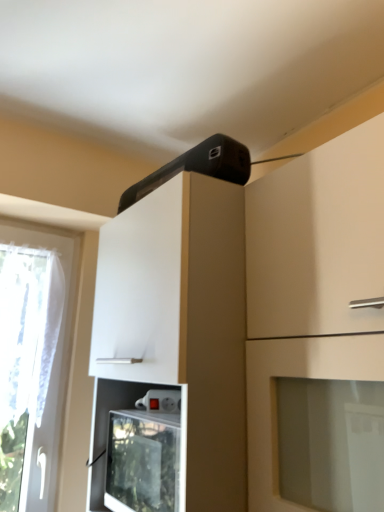
Question: From a real-world perspective, is white glossy cabinet at upper center, the first cabinetry positioned from the left, below black plastic speaker at upper center?

Choices:
 (A) no
 (B) yes

Answer: (B)

Question: Could black plastic speaker at upper center be considered to be inside white glossy cabinet at upper center, the first cabinetry positioned from the left?

Choices:
 (A) no
 (B) yes

Answer: (A)

Question: From a real-world perspective, is white glossy cabinet at upper center, the first cabinetry positioned from the left, located higher than black plastic speaker at upper center?

Choices:
 (A) no
 (B) yes

Answer: (A)

Question: Is white glossy cabinet at upper center, the second cabinetry positioned from the right, positioned beyond the bounds of black plastic speaker at upper center?

Choices:
 (A) yes
 (B) no

Answer: (A)

Question: Does white glossy cabinet at upper center, the first cabinetry positioned from the left, come in front of black plastic speaker at upper center?

Choices:
 (A) no
 (B) yes

Answer: (B)

Question: Based on their sizes in the image, would you say black plastic speaker at upper center is bigger or smaller than white glossy cabinet at upper center, the second cabinetry positioned from the right?

Choices:
 (A) big
 (B) small

Answer: (B)

Question: From their relative heights in the image, would you say black plastic speaker at upper center is taller or shorter than white glossy cabinet at upper center, the second cabinetry positioned from the right?

Choices:
 (A) short
 (B) tall

Answer: (A)

Question: From a real-world perspective, relative to white glossy cabinet at upper center, the second cabinetry positioned from the right, is black plastic speaker at upper center vertically above or below?

Choices:
 (A) above
 (B) below

Answer: (A)

Question: From the image's perspective, is black plastic speaker at upper center located above or below white glossy cabinet at upper center, the first cabinetry positioned from the left?

Choices:
 (A) below
 (B) above

Answer: (B)

Question: Is white glossy cabinet at upper center, the first cabinetry positioned from the left, inside or outside of black plastic speaker at upper center?

Choices:
 (A) outside
 (B) inside

Answer: (A)

Question: In terms of size, does white glossy cabinet at upper center, the second cabinetry positioned from the right, appear bigger or smaller than black plastic speaker at upper center?

Choices:
 (A) big
 (B) small

Answer: (A)

Question: Is white glossy cabinet at upper center, the first cabinetry positioned from the left, to the left or to the right of black plastic speaker at upper center in the image?

Choices:
 (A) right
 (B) left

Answer: (A)

Question: Considering their positions, is white glossy cabinet at upper center, the first cabinetry positioned from the left, located in front of or behind black plastic speaker at upper center?

Choices:
 (A) front
 (B) behind

Answer: (A)

Question: From a real-world perspective, is black plastic speaker at upper center physically located above or below white glossy cabinet at upper center, the second cabinetry in the left-to-right sequence?

Choices:
 (A) below
 (B) above

Answer: (B)

Question: Does point (170, 174) appear closer or farther from the camera than point (304, 421)?

Choices:
 (A) closer
 (B) farther

Answer: (B)